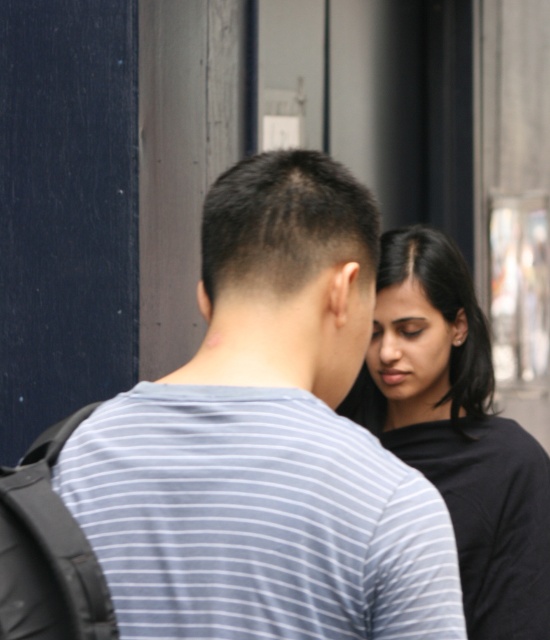
You are a photographer trying to capture a group photo of the two people in the scene. The minimum distance required between subjects for the camera to focus properly is 3.5 feet. Can you take a clear photo of both the gray striped shirt at center and the black matte shirt at right without moving them?

The gray striped shirt at center and the black matte shirt at right are 4.00 feet apart from each other, which exceeds the minimum required distance of 3.5 feet. Therefore, the photographer can take a clear photo of both subjects without moving them.

You are standing in front of the two people in the image. You want to place a small sticker on the point that is closer to you. Which point should you choose between point (x=374, y=480) and point (x=517, y=518)?

You should choose point (x=374, y=480) because it is closer to the viewer than point (x=517, y=518).

You are a photographer trying to capture a candid shot of both the gray striped shirt at center and the black matte shirt at right. Since you want to ensure both are in focus, which one should you focus on first to maximize the chances of both being sharp?

You should focus on the gray striped shirt at center first because it is closer to the viewer than the black matte shirt at right. By focusing on the closer object, the depth of field will extend backward, increasing the likelihood that both subjects are in acceptable focus.